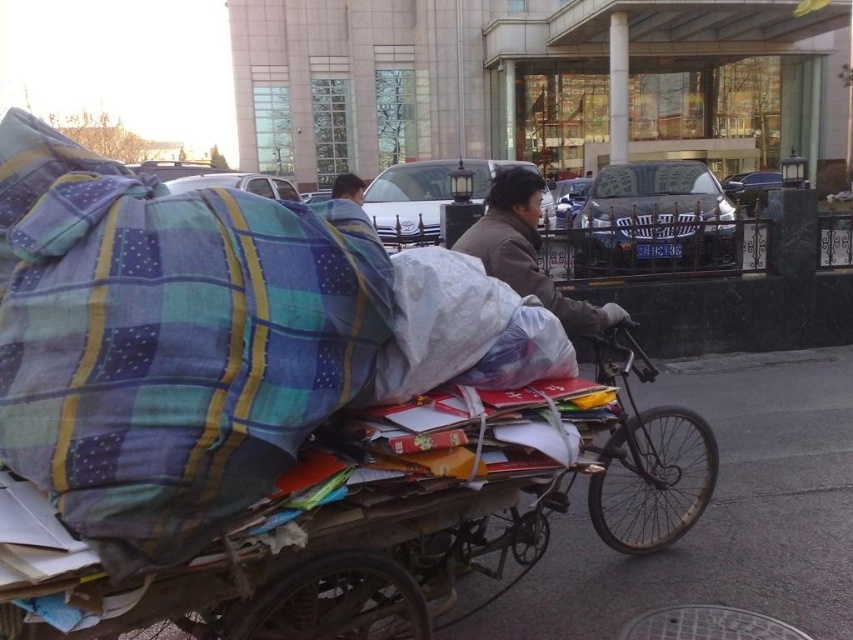
You are a delivery person who needs to move the wooden cart at center and the brown fuzzy coat at center through a narrow doorway. Based on their sizes, which object might be harder to fit through the doorway?

The wooden cart at center is taller than the brown fuzzy coat at center, so the wooden cart at center might be harder to fit through the narrow doorway due to its greater height.